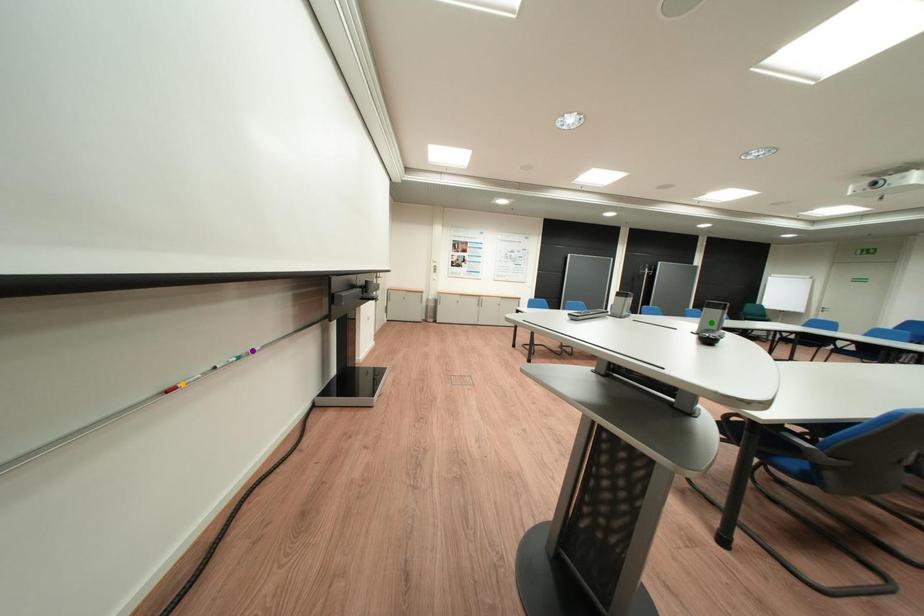
Order these from nearest to farthest:
A) orange point
B) green point
C) purple point

1. orange point
2. purple point
3. green point